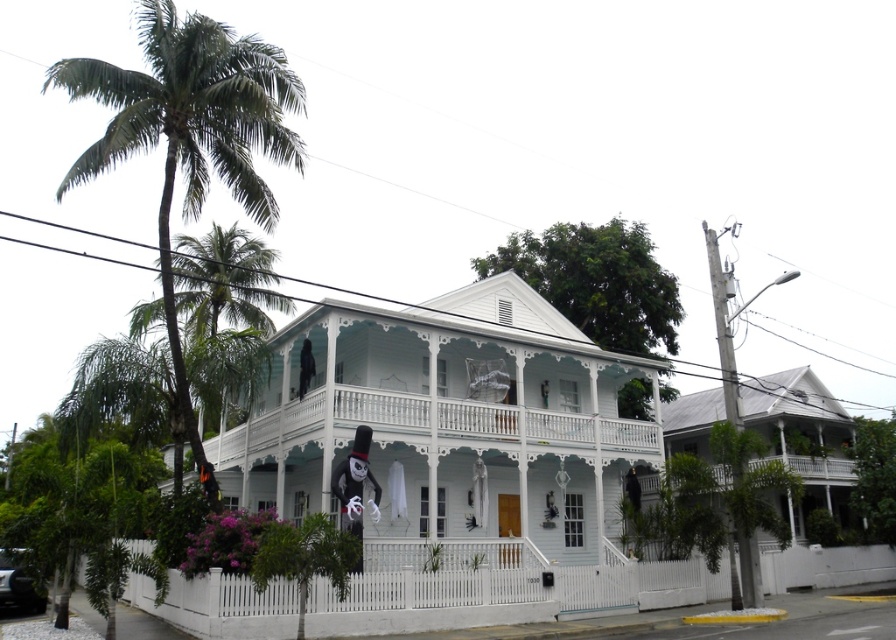
Does green leafy palm tree at left appear over black glossy car at lower left?

Yes, green leafy palm tree at left is above black glossy car at lower left.

Between green leafy palm tree at left and black glossy car at lower left, which one is positioned higher?

green leafy palm tree at left is higher up.

Who is more forward, (169,140) or (26,593)?

Point (26,593) is in front.

Where is `green leafy palm tree at left`? Image resolution: width=896 pixels, height=640 pixels. green leafy palm tree at left is located at coordinates (188, 129).

Is white painted wood porch at center further to camera compared to black glossy car at lower left?

Yes, it is behind black glossy car at lower left.

Who is lower down, white painted wood porch at center or black glossy car at lower left?

Positioned lower is black glossy car at lower left.

The height and width of the screenshot is (640, 896). In order to click on white painted wood porch at center in this screenshot , I will do `click(429, 428)`.

Between point (171, 68) and point (462, 406), which one is positioned behind?

Point (462, 406)

Is green leafy palm tree at left to the right of white painted wood porch at center from the viewer's perspective?

In fact, green leafy palm tree at left is to the left of white painted wood porch at center.

What do you see at coordinates (188, 129) in the screenshot? Image resolution: width=896 pixels, height=640 pixels. I see `green leafy palm tree at left` at bounding box center [188, 129].

The image size is (896, 640). I want to click on green leafy palm tree at left, so pos(188,129).